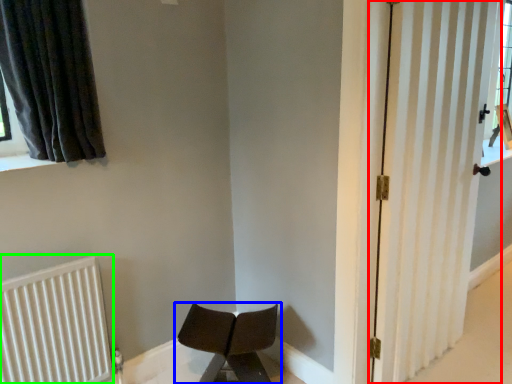
Question: Which object is positioned farthest from door (highlighted by a red box)? Select from chair (highlighted by a blue box) and radiator (highlighted by a green box).

Choices:
 (A) chair
 (B) radiator

Answer: (B)